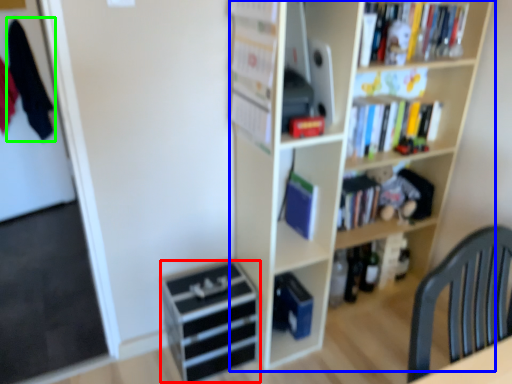
Question: Which object is positioned farthest from drawer (highlighted by a red box)? Select from bookcase (highlighted by a blue box) and clothe (highlighted by a green box).

Choices:
 (A) bookcase
 (B) clothe

Answer: (B)